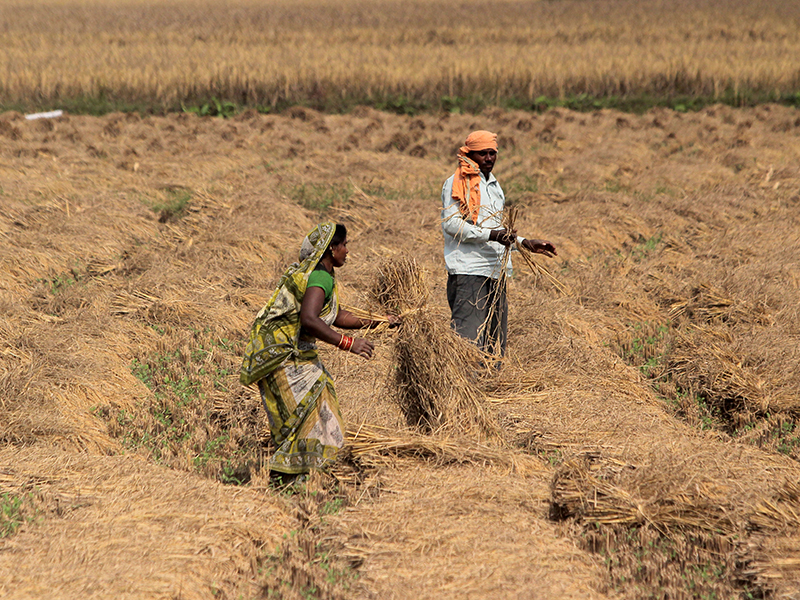
Identify the location of plant. Image resolution: width=800 pixels, height=600 pixels. (166, 380), (10, 507), (308, 551), (654, 337), (170, 197).